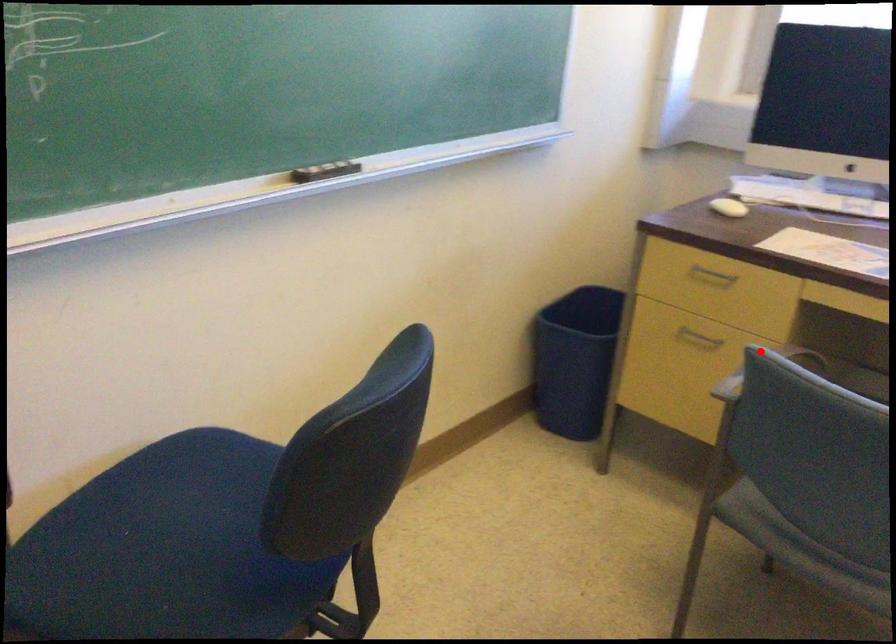
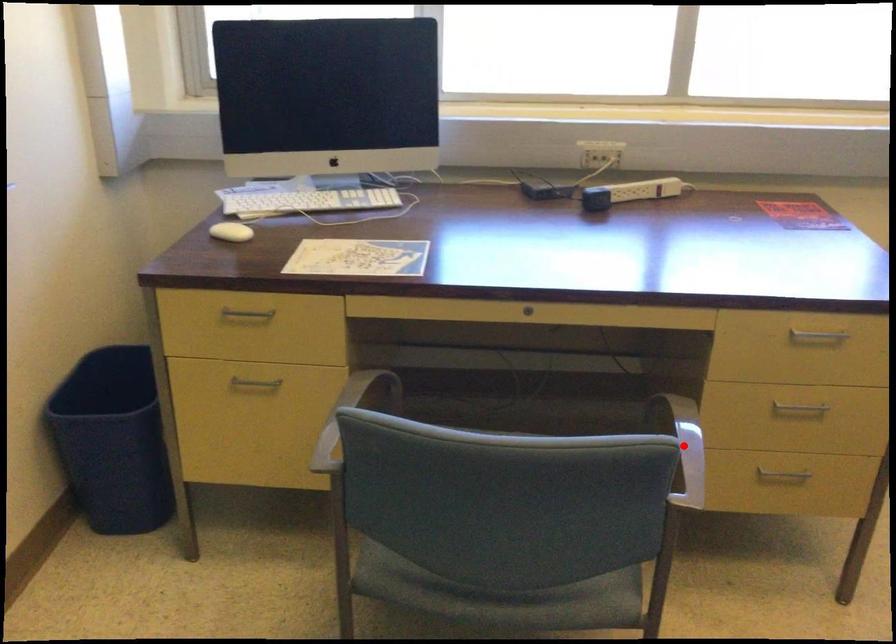
I am providing you with two images of the same scene from different viewpoints. A red point is marked on the first image and another point is marked on the second image. Does the point marked in image1 correspond to the same location as the one in image2?

No